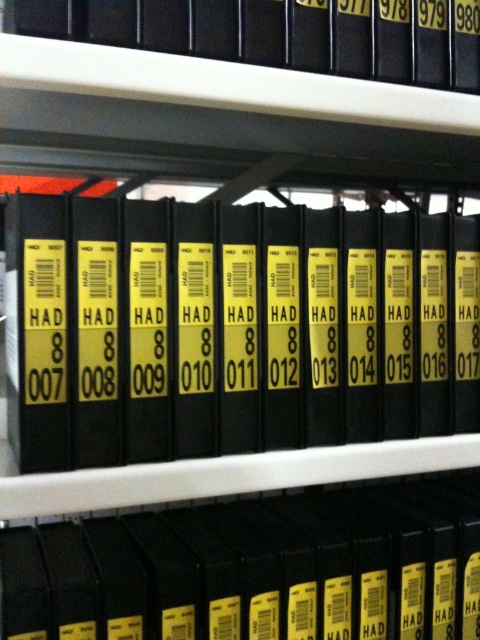
Does black matte book at center appear over black matte file at upper center?

No.

Measure the distance between black matte book at center and black matte file at upper center.

black matte book at center and black matte file at upper center are 7.98 inches apart from each other.

Locate an element on the screen. This screenshot has width=480, height=640. black matte book at center is located at coordinates (297, 328).

At what (x,y) coordinates should I click in order to perform the action: click on black matte book at center. Please return your answer as a coordinate pair (x, y). Looking at the image, I should click on tap(297, 328).

Is point (421, 570) positioned behind point (380, 20)?

That is True.

Image resolution: width=480 pixels, height=640 pixels. In order to click on black matte file at center in this screenshot , I will do `click(255, 568)`.

Is black matte book at center positioned in front of black matte file at center?

Yes.

Which is more to the left, black matte book at center or black matte file at center?

black matte book at center

Between point (271, 227) and point (383, 500), which one is positioned in front?

Point (271, 227)

The width and height of the screenshot is (480, 640). I want to click on black matte book at center, so click(297, 328).